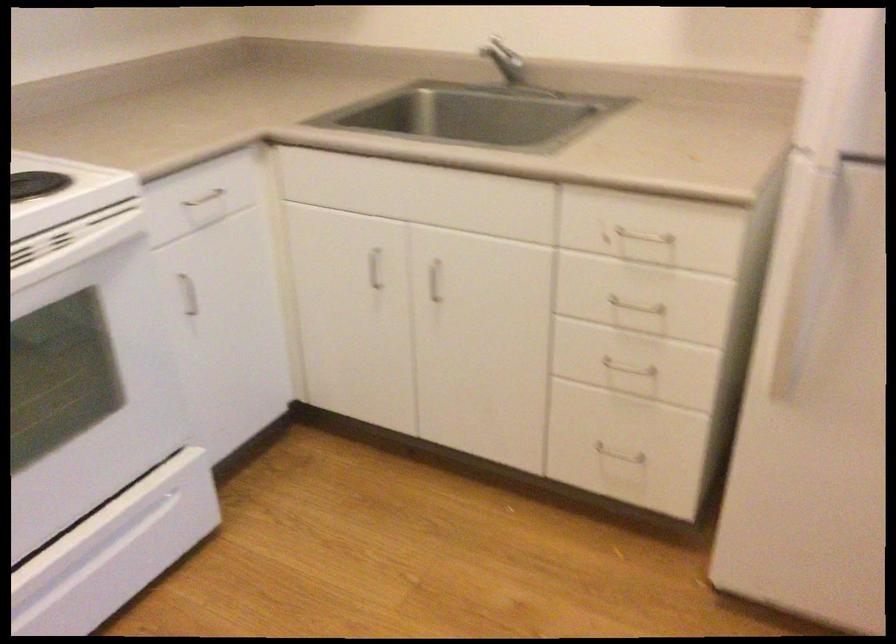
The height and width of the screenshot is (644, 896). Identify the location of white oven handle. (73, 243).